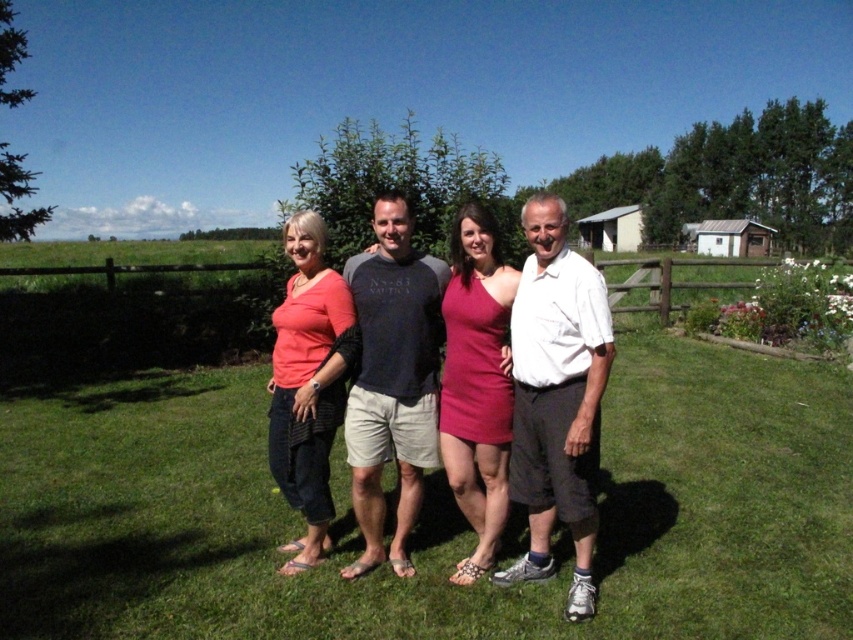
You are standing at the point marked as point (432, 515) in the image. What is the color of the ground beneath your feet?

The ground beneath your feet at point (432, 515) is green grass at center.